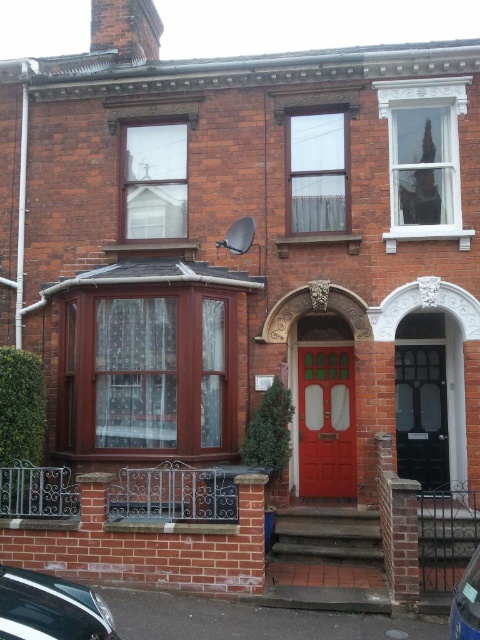
Does matte red door at center have a lesser height compared to shiny black car at lower left?

No, matte red door at center is not shorter than shiny black car at lower left.

Describe the element at coordinates (325, 422) in the screenshot. I see `matte red door at center` at that location.

Locate an element on the screen. Image resolution: width=480 pixels, height=640 pixels. matte red door at center is located at coordinates (325, 422).

Which is below, matte red door at center or black textured door at center?

matte red door at center is lower down.

Identify the location of matte red door at center. (325, 422).

I want to click on matte red door at center, so click(325, 422).

You are a GUI agent. You are given a task and a screenshot of the screen. Output one action in this format:
    pyautogui.click(x=<x>, y=<y>)
    Task: Click on the black textured door at center
    
    Given the screenshot: What is the action you would take?
    pyautogui.click(x=421, y=413)